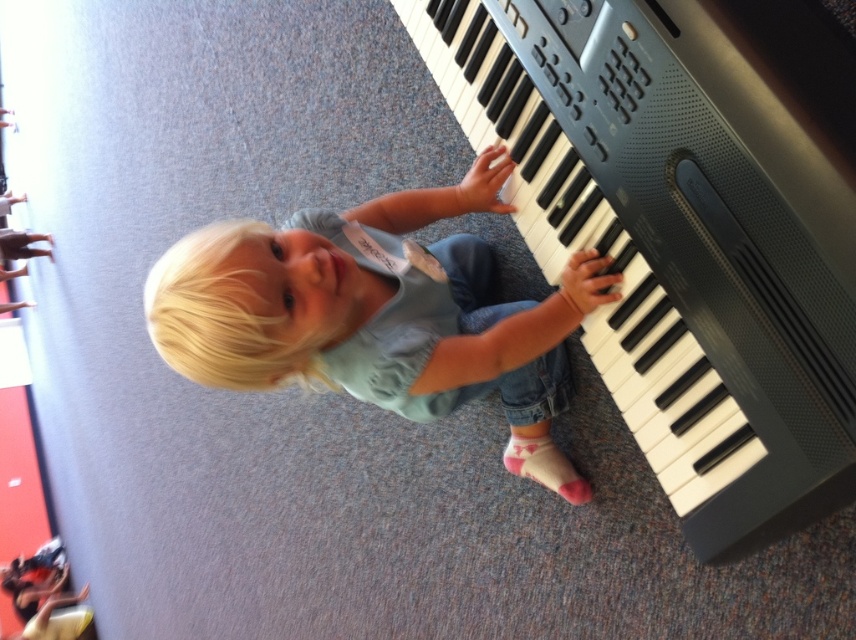
You are a photographer setting up for a photo shoot. You need to position a light source so that it illuminates both the black plastic keyboard at right and the blonde hair at center without casting harsh shadows. Given their sizes, which object should you place closer to the light source to achieve even lighting?

The black plastic keyboard at right is thinner than blonde hair at center, so you should place the thinner black plastic keyboard at right closer to the light source to ensure both receive adequate illumination.

You are a photographer setting up for a family photo. You need to ensure that the black plastic keyboard at right and the blonde hair at center are both in focus. Given that the keyboard is smaller than the blonde hair, which object should you adjust your camera focus on first to ensure both are sharp?

Since the black plastic keyboard at right is smaller than the blonde hair at center, you should focus on the smaller object first. This ensures that the details of the keyboard are captured clearly before adjusting for the larger area of the blonde hair.

Based on the photo, you are taking a photo of the scene and want to focus on both point [815,352] and point [453,349]. Which point should you focus on first to ensure both are in sharp focus?

You should focus on point [815,352] first because it is closer to the camera than point [453,349]. By focusing on the closer point, the farther point will also be within the depth of field and appear sharp.